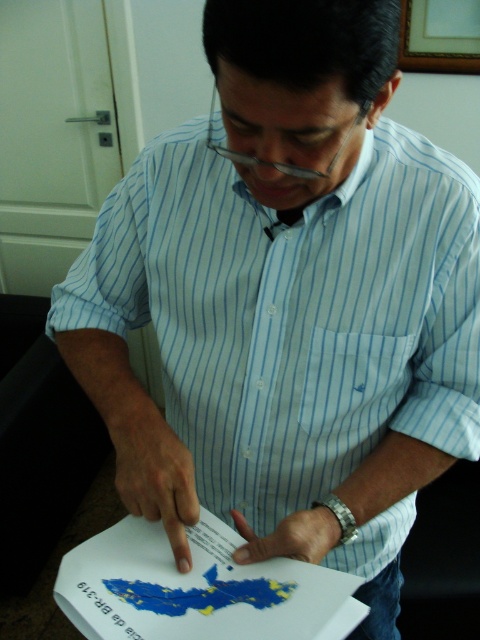
What are the coordinates of the blue paper map at lower center?

The coordinates of the blue paper map at lower center are at point (199, 588).